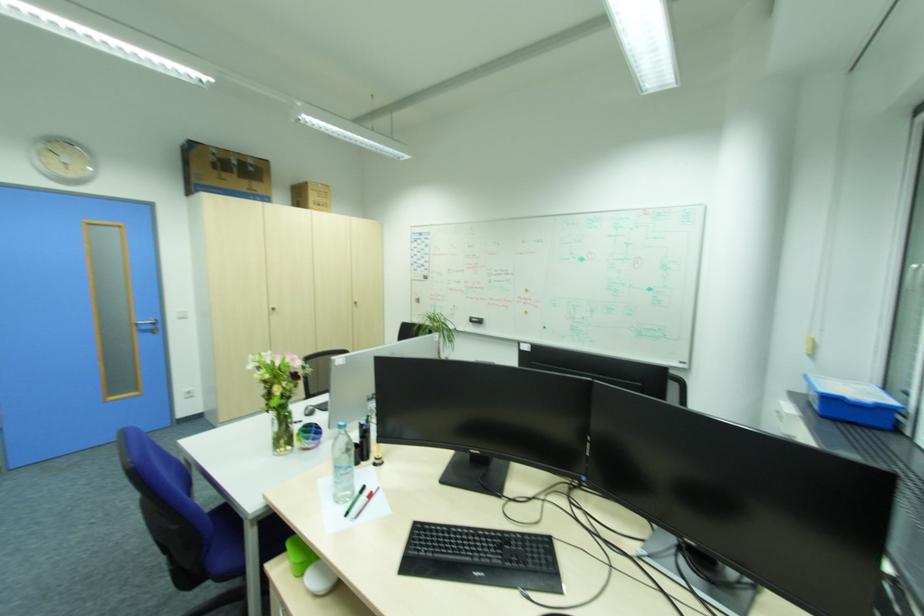
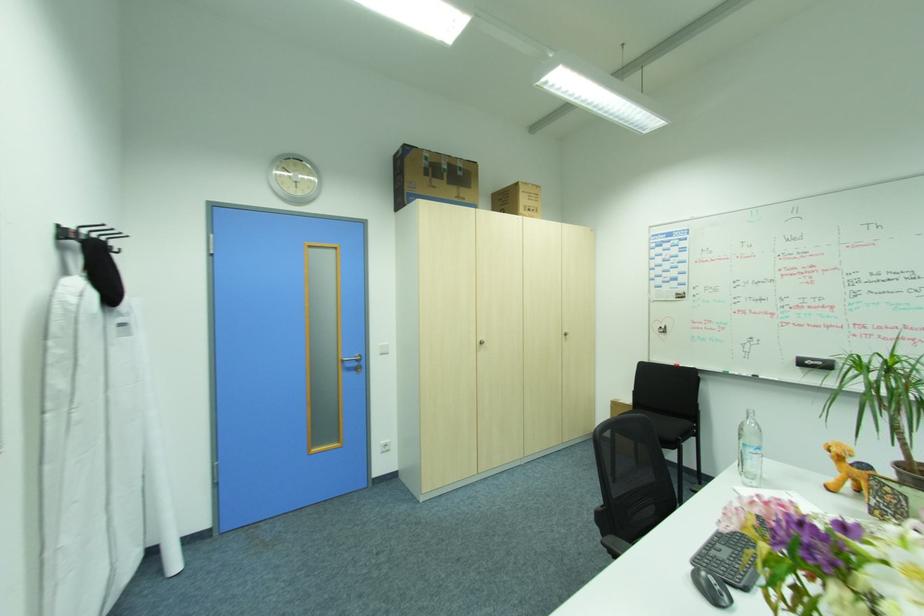
Locate, in the second image, the point that corresponds to pixel 482 318 in the first image.

(824, 363)